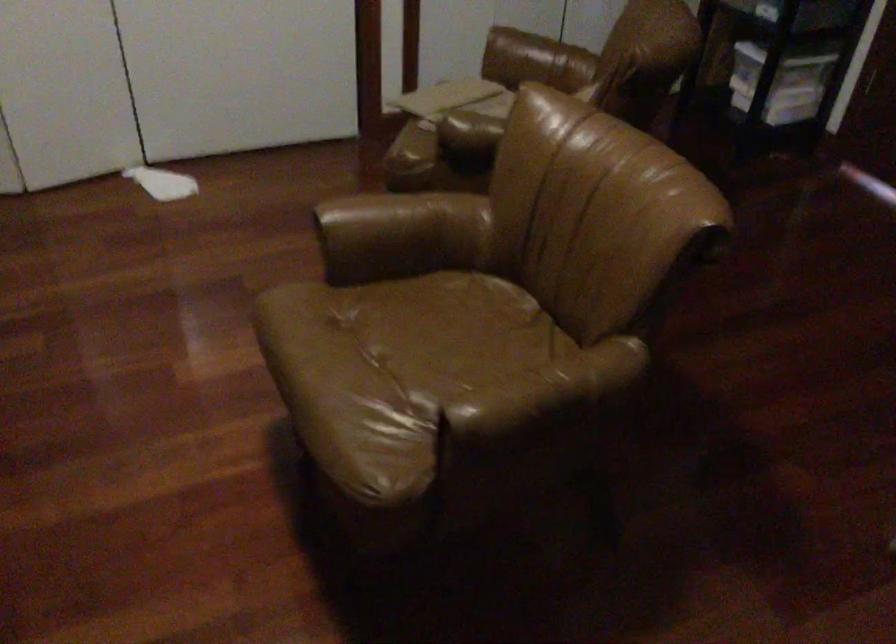
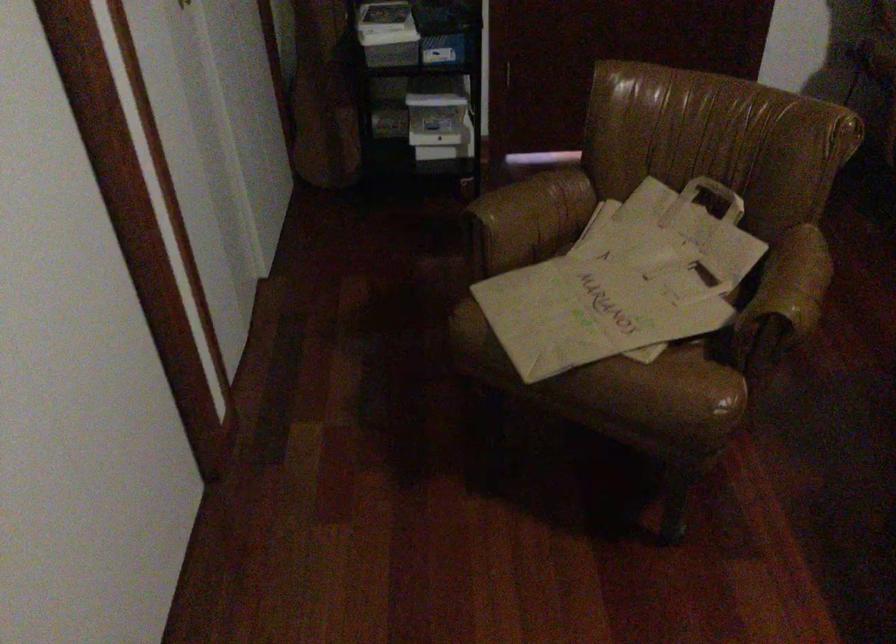
Find the pixel in the second image that matches (613,102) in the first image.

(716, 194)